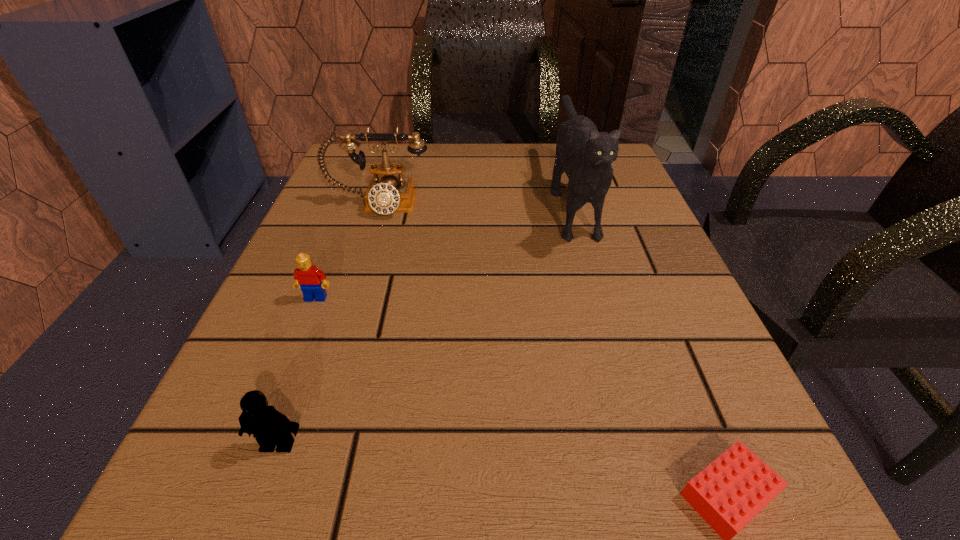
Image resolution: width=960 pixels, height=540 pixels. Find the location of `free spot between the third farthest object and the cat`. free spot between the third farthest object and the cat is located at coordinates (444, 247).

Identify the location of free space that is in between the farthest Lego and the telephone. This screenshot has height=540, width=960. (347, 252).

Identify the location of unoccupied area between the farthest Lego and the telephone. (347, 252).

Image resolution: width=960 pixels, height=540 pixels. Identify the location of object that can be found as the fourth closest to the tallest object. (271, 428).

Choose which object is the second nearest neighbor to the second tallest object. Please provide its 2D coordinates. Your answer should be formatted as a tuple, i.e. [(x, y)], where the tuple contains the x and y coordinates of a point satisfying the conditions above.

[(585, 155)]

You are a GUI agent. You are given a task and a screenshot of the screen. Output one action in this format:
    pyautogui.click(x=<x>, y=<y>)
    Task: Click on the Lego that is the second nearest to the shortest object
    This screenshot has height=540, width=960.
    Given the screenshot: What is the action you would take?
    pyautogui.click(x=308, y=277)

Select which Lego appears as the second closest to the farthest Lego. Please provide its 2D coordinates. Your answer should be formatted as a tuple, i.e. [(x, y)], where the tuple contains the x and y coordinates of a point satisfying the conditions above.

[(734, 488)]